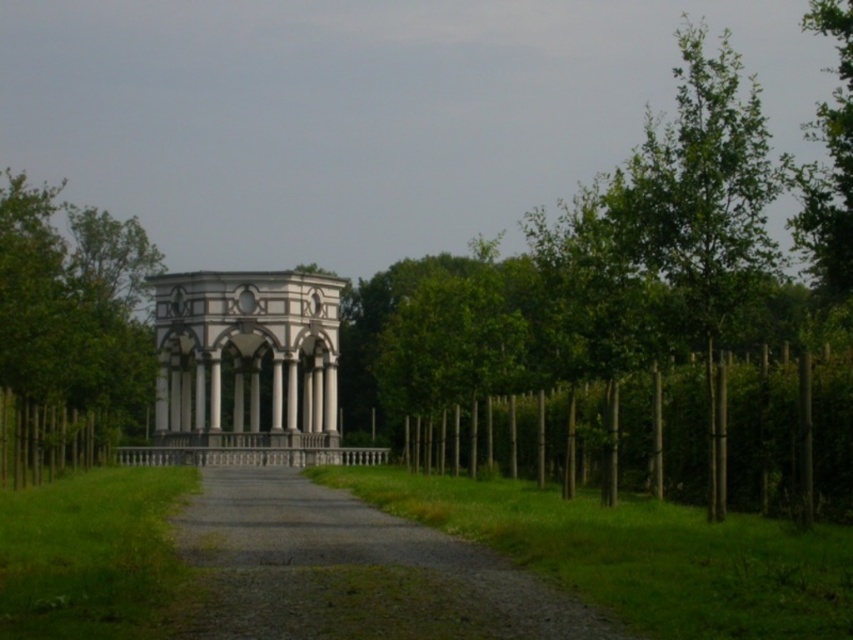
You are standing at the entrance of the pavilion and want to walk to the green leafy tree at upper right. There is a green leafy tree at left blocking your path. Can you walk straight to the tree without going around it?

The green leafy tree at left is 81.01 meters away from the green leafy tree at upper right. Since the distance between them is quite large, you can walk straight to the green leafy tree at upper right without being blocked by the green leafy tree at left.

You are standing at the start of the pathway leading to the pavilion. You notice two points marked on the ground ahead of you. The first point is located at coordinates point (120, 420), and the second point is at point (194, 401). Which point is closer to you as you face the direction of the pavilion?

Point (120, 420) is closer to you because it is in front of point (194, 401) along the pathway towards the pavilion.

You are planning to take a photo of the green leafy tree at left and the white marble gazebo at center from a position where both are visible. Based on their sizes in the image, which object would appear wider in the photo?

The green leafy tree at left appears wider in the photo because its width is larger than that of the white marble gazebo at center.